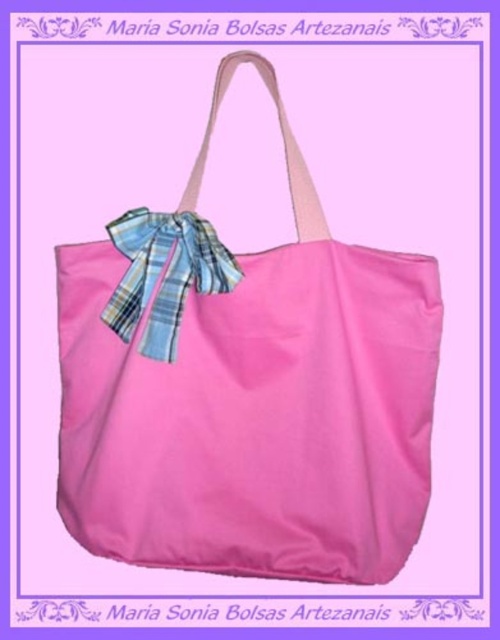
Question: Does matte pink fabric shoulder bag at center appear on the left side of plaid fabric bow at center?

Choices:
 (A) yes
 (B) no

Answer: (B)

Question: Can you confirm if matte pink fabric shoulder bag at center is positioned to the right of plaid fabric bow at center?

Choices:
 (A) no
 (B) yes

Answer: (B)

Question: Can you confirm if matte pink fabric shoulder bag at center is smaller than plaid fabric bow at center?

Choices:
 (A) no
 (B) yes

Answer: (A)

Question: Which point appears closest to the camera in this image?

Choices:
 (A) (205, 275)
 (B) (155, 227)

Answer: (A)

Question: Which of the following is the farthest from the observer?

Choices:
 (A) (265, 486)
 (B) (126, 240)

Answer: (A)